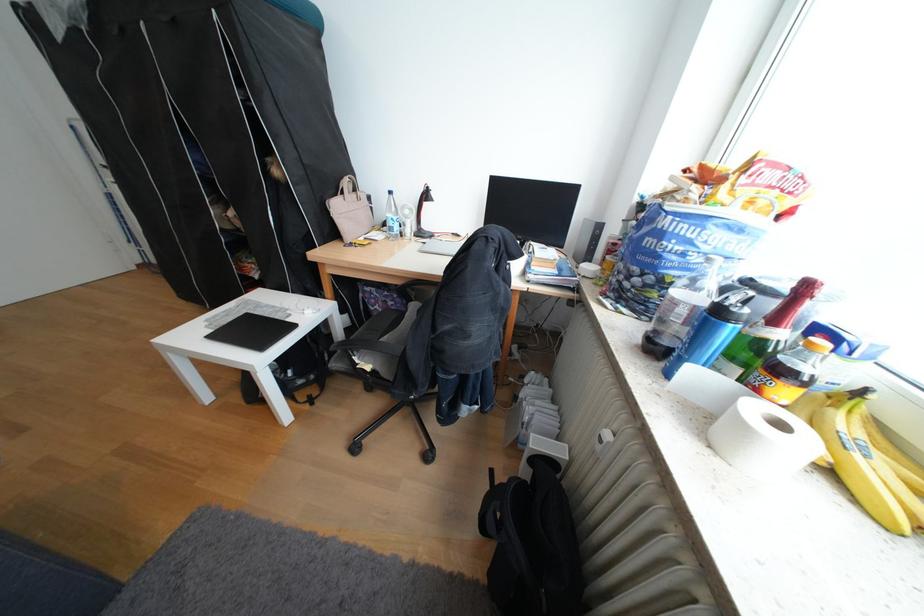
Locate an element on the screen. Image resolution: width=924 pixels, height=616 pixels. chair sitting surface is located at coordinates (382, 320).